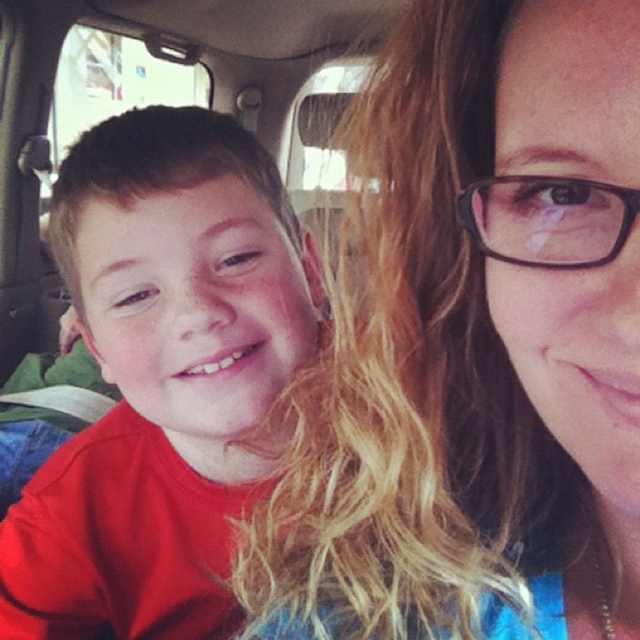
Does blonde hair at center lie in front of matte red shirt at left?

That is True.

Does point (348, 228) come behind point (88, 177)?

That is False.

Is point (518, 10) more distant than point (204, 216)?

That is False.

At what (x,y) coordinates should I click in order to perform the action: click on blonde hair at center. Please return your answer as a coordinate pair (x, y). Image resolution: width=640 pixels, height=640 pixels. Looking at the image, I should click on (474, 346).